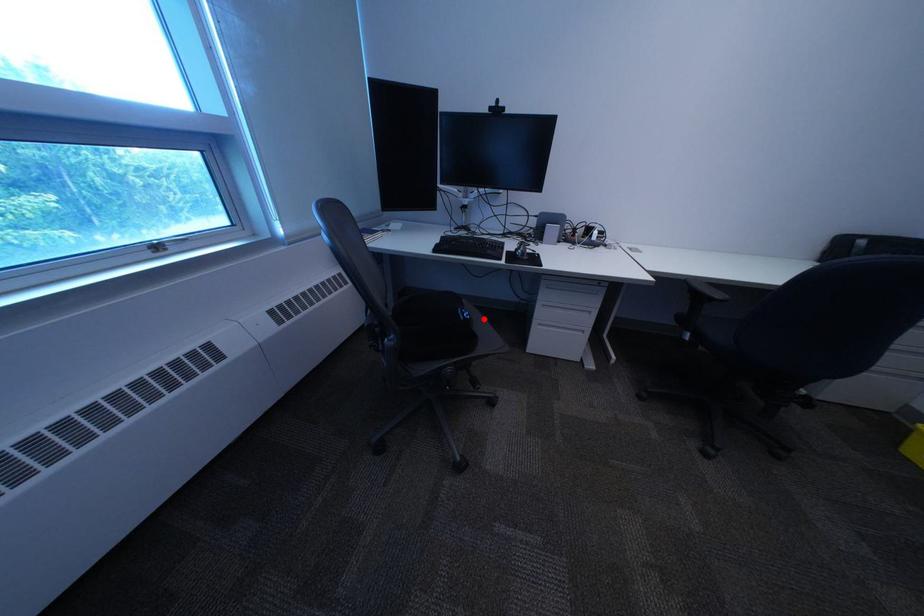
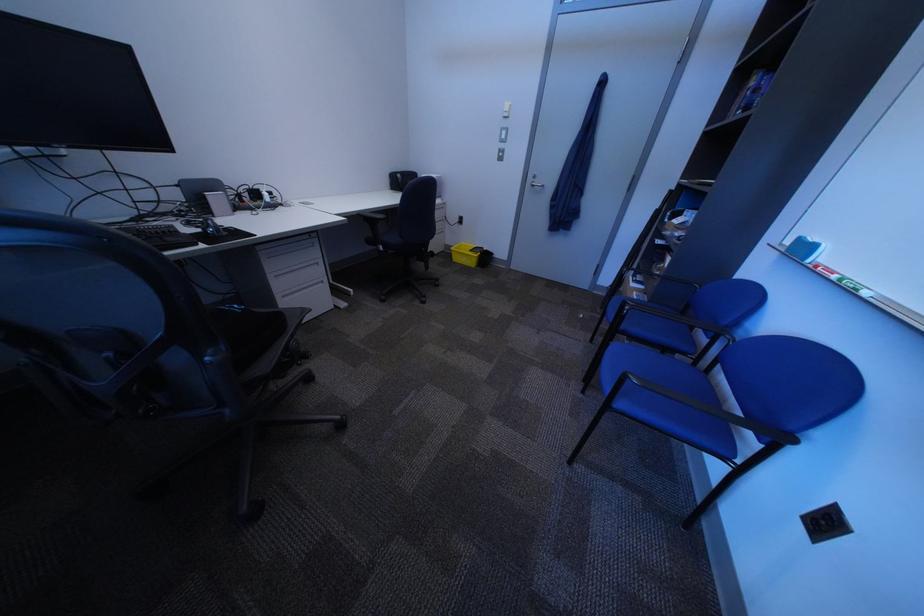
Question: I am providing you with two images of the same scene from different viewpoints. A red point is marked on the first image. At the location where the point appears in image 1, is it still visible in image 2?

Choices:
 (A) Yes
 (B) No

Answer: (A)